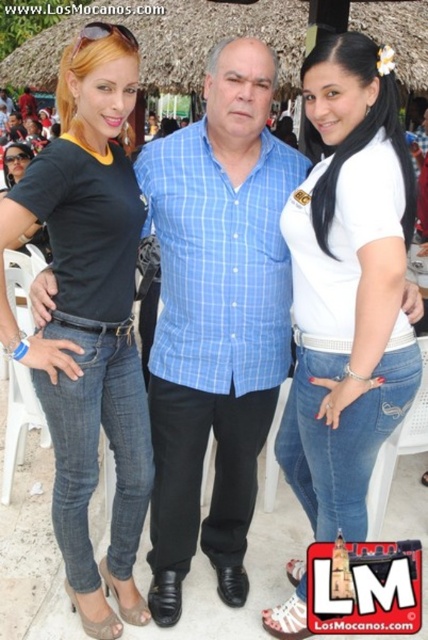
Is white matte shirt at center to the right of matte black shirt at left from the viewer's perspective?

Correct, you'll find white matte shirt at center to the right of matte black shirt at left.

Does white matte shirt at center have a smaller size compared to matte black shirt at left?

Yes.

Where is `white matte shirt at center`? white matte shirt at center is located at coordinates (348, 285).

Image resolution: width=428 pixels, height=640 pixels. Identify the location of white matte shirt at center. (348, 285).

Which is below, blue checkered shirt at center or white matte shirt at center?

Positioned lower is blue checkered shirt at center.

Can you confirm if blue checkered shirt at center is positioned below white matte shirt at center?

Yes, blue checkered shirt at center is below white matte shirt at center.

Who is more distant from viewer, (174,376) or (377,189)?

The point (174,376) is behind.

Locate an element on the screen. This screenshot has height=640, width=428. blue checkered shirt at center is located at coordinates (216, 317).

Is point (222, 122) farther from viewer compared to point (139, 451)?

No, it is in front of (139, 451).

Does blue checkered shirt at center have a greater height compared to matte black shirt at left?

Yes, blue checkered shirt at center is taller than matte black shirt at left.

At what (x,y) coordinates should I click in order to perform the action: click on blue checkered shirt at center. Please return your answer as a coordinate pair (x, y). This screenshot has height=640, width=428. Looking at the image, I should click on (216, 317).